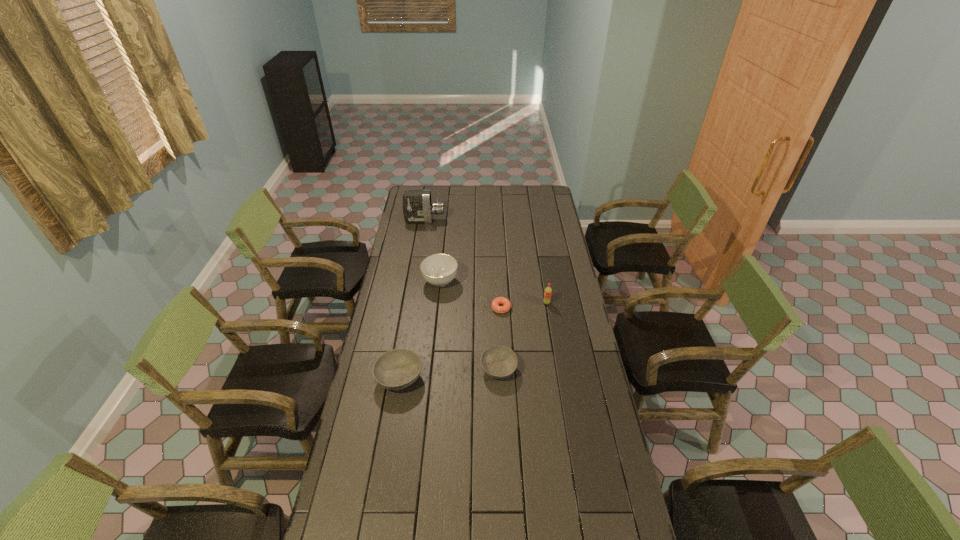
This screenshot has height=540, width=960. I want to click on vacant space at the right edge of the desktop, so click(x=570, y=308).

This screenshot has height=540, width=960. I want to click on vacant space at the far right corner of the desktop, so click(x=537, y=188).

Image resolution: width=960 pixels, height=540 pixels. Find the location of `vacant space that's between the left bowl and the rightmost object`. vacant space that's between the left bowl and the rightmost object is located at coordinates (473, 340).

Identify the location of free area in between the shortest object and the rightmost object. The image size is (960, 540). [x=524, y=306].

Where is `empty location between the fourth shortest object and the fourth tallest object`? Image resolution: width=960 pixels, height=540 pixels. empty location between the fourth shortest object and the fourth tallest object is located at coordinates (420, 329).

Where is `vacant area that lies between the chinaware and the rightmost object`? This screenshot has width=960, height=540. vacant area that lies between the chinaware and the rightmost object is located at coordinates (493, 292).

The image size is (960, 540). What are the coordinates of `vacant space in between the third tallest object and the soda` in the screenshot? It's located at (493, 292).

At what (x,y) coordinates should I click in order to perform the action: click on unoccupied area between the taller bowl and the third tallest object. Please return your answer as a coordinate pair (x, y). This screenshot has width=960, height=540. Looking at the image, I should click on (420, 329).

Locate an element on the screen. Image resolution: width=960 pixels, height=540 pixels. free spot between the taller bowl and the camcorder is located at coordinates (412, 299).

Image resolution: width=960 pixels, height=540 pixels. In order to click on free point between the fourth tallest object and the shorter bowl in this screenshot , I will do `click(449, 374)`.